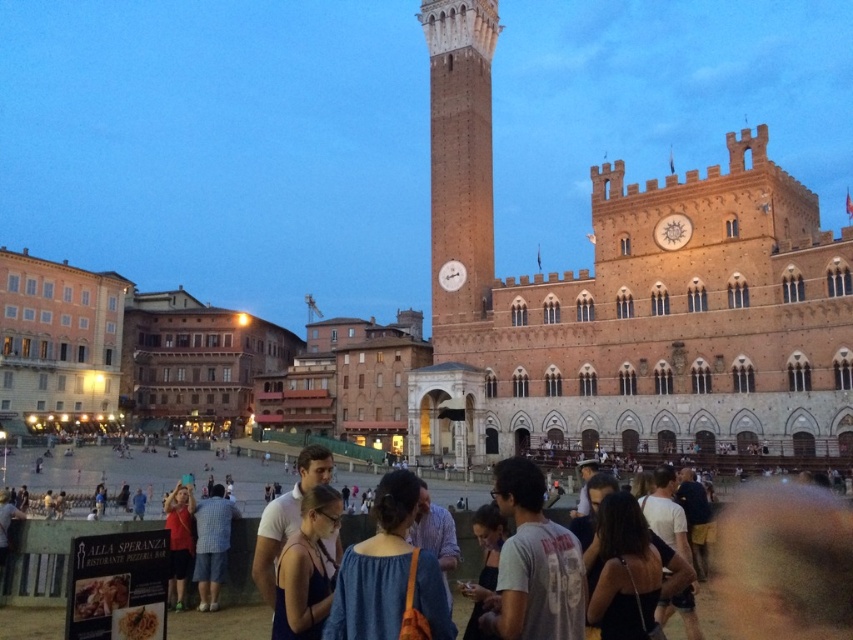
You are a tourist standing at the edge of Piazza del Campo in Siena. You see the dark blue fabric crowd at lower center and the brick clock tower at center. Which object is closer to your current position?

The dark blue fabric crowd at lower center is closer to your current position because it is located below the brick clock tower at center, indicating it is nearer in the visual hierarchy.